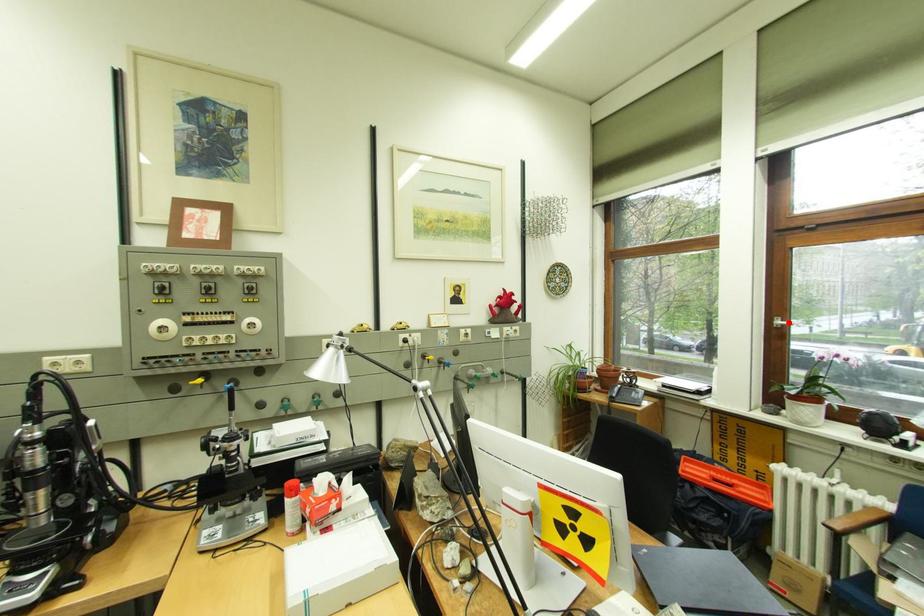
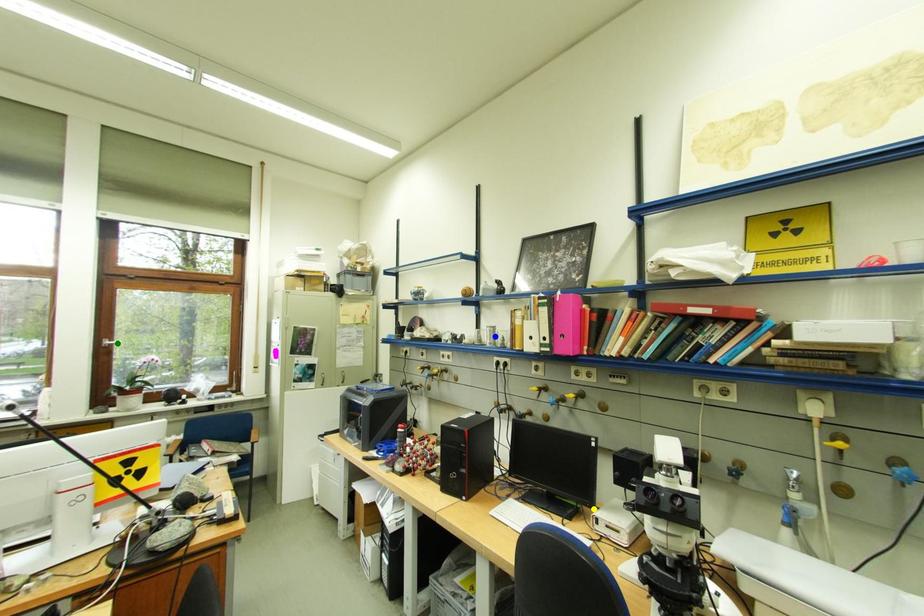
Question: I am providing you with two images of the same scene from different viewpoints. A red point is marked on the first image. You are given multiple points on the second image. In image 2, which mark is for the same physical point as the one in image 1?

Choices:
 (A) green point
 (B) yellow point
 (C) blue point

Answer: (A)